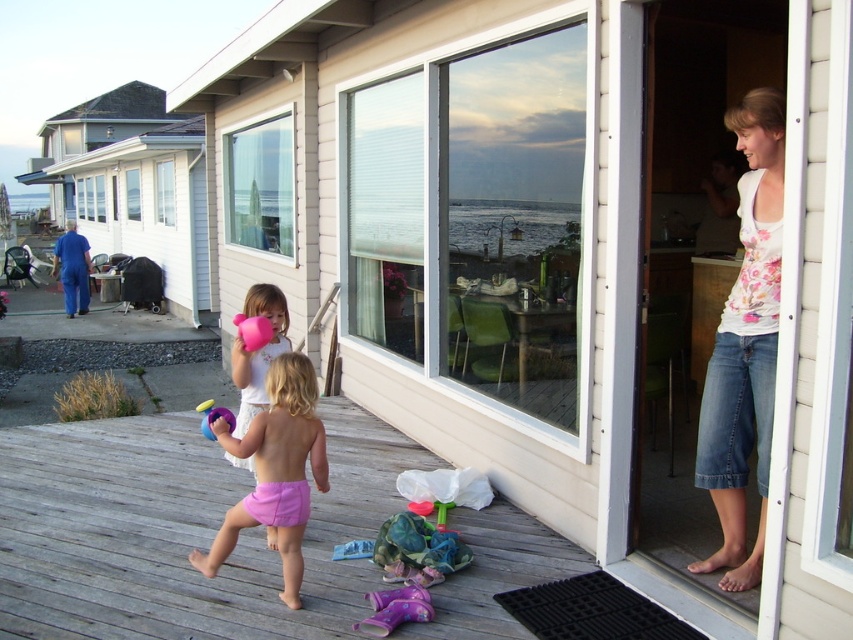
Which is more to the left, pink fabric shorts at lower center or rubber pink ball at center?

pink fabric shorts at lower center

Can you confirm if pink fabric shorts at lower center is smaller than rubber pink ball at center?

No, pink fabric shorts at lower center is not smaller than rubber pink ball at center.

The width and height of the screenshot is (853, 640). What do you see at coordinates (178, 531) in the screenshot?
I see `pink fabric shorts at lower center` at bounding box center [178, 531].

Identify the location of pink fabric shorts at lower center. (178, 531).

The height and width of the screenshot is (640, 853). I want to click on pink matte watering can at center, so click(257, 352).

Does pink matte watering can at center lie behind rubber pink ball at center?

No, it is in front of rubber pink ball at center.

Find the location of a particular element. The image size is (853, 640). pink matte watering can at center is located at coordinates (257, 352).

Identify the location of pink matte watering can at center. (257, 352).

Between point (740, 3) and point (256, 310), which one is positioned behind?

Point (740, 3)

Between white matte screen door at upper right and pink matte watering can at center, which one is positioned higher?

white matte screen door at upper right is higher up.

Is point (756, 532) closer to camera compared to point (265, 392)?

That is False.

At what (x,y) coordinates should I click in order to perform the action: click on white matte screen door at upper right. Please return your answer as a coordinate pair (x, y). Looking at the image, I should click on (709, 285).